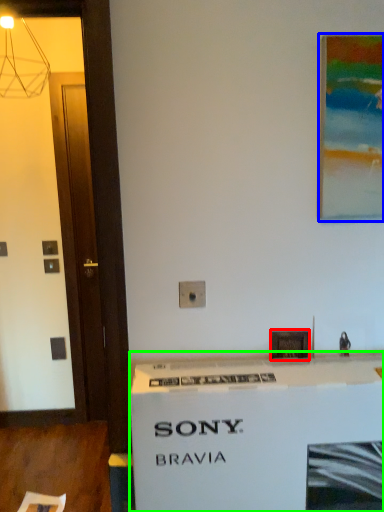
Question: Which is nearer to the picture frame (highlighted by a red box)? picture frame (highlighted by a blue box) or counter (highlighted by a green box).

Choices:
 (A) picture frame
 (B) counter

Answer: (B)